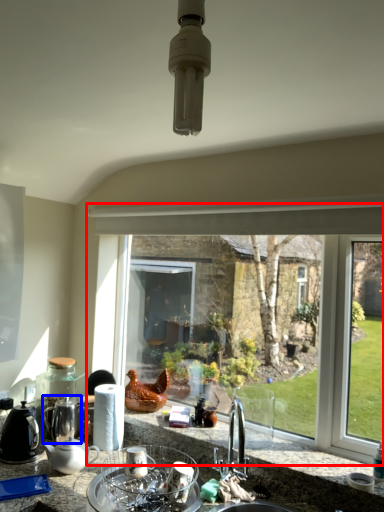
Question: Among these objects, which one is nearest to the camera, window (highlighted by a red box) or tea pot (highlighted by a blue box)?

Choices:
 (A) window
 (B) tea pot

Answer: (A)